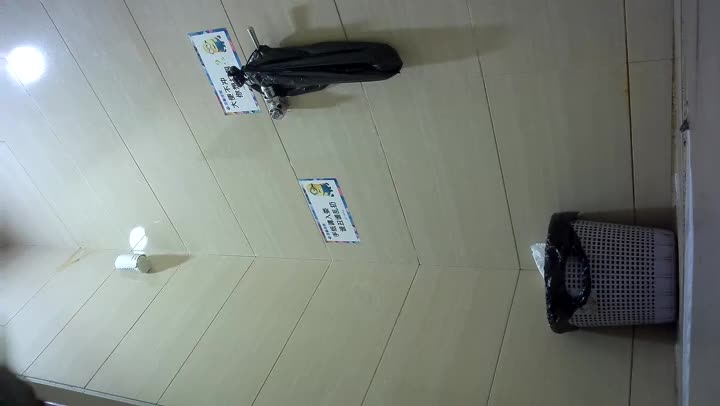
Where is `trash can`? This screenshot has height=406, width=720. trash can is located at coordinates (634, 268).